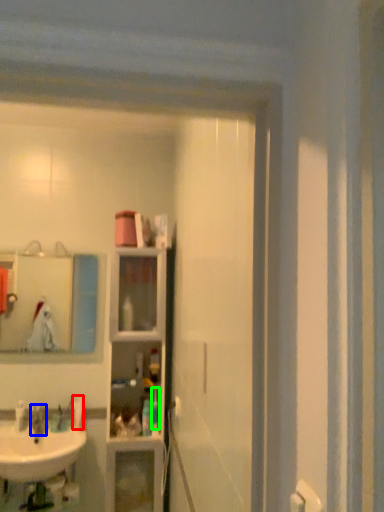
Question: Based on their relative distances, which object is nearer to toiletry (highlighted by a red box)? Choose from faucet (highlighted by a blue box) and toiletry (highlighted by a green box).

Choices:
 (A) faucet
 (B) toiletry

Answer: (A)